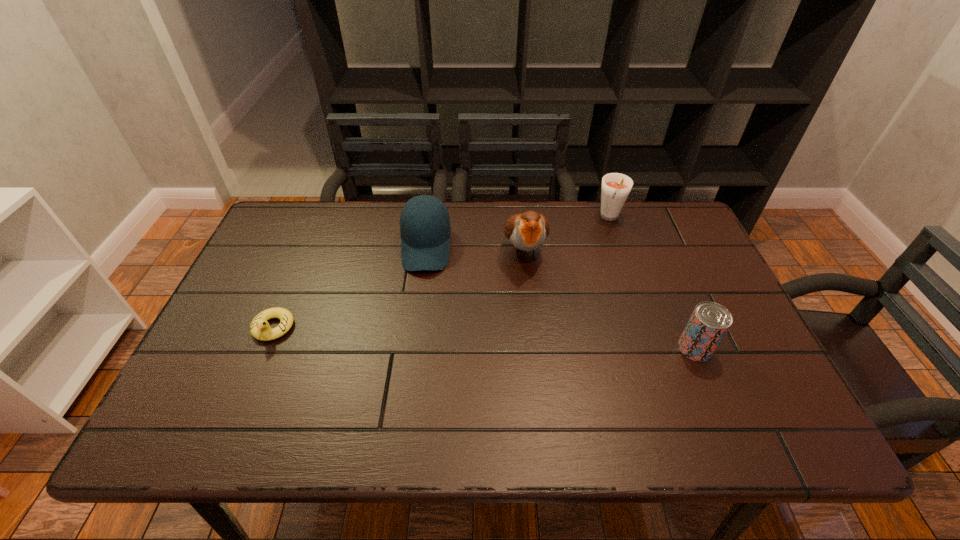
This screenshot has width=960, height=540. I want to click on the leftmost object, so click(260, 329).

You are a GUI agent. You are given a task and a screenshot of the screen. Output one action in this format:
    pyautogui.click(x=<x>, y=<y>)
    Task: Click on the duckling
    
    Given the screenshot: What is the action you would take?
    pyautogui.click(x=260, y=329)

Locate an element on the screen. The width and height of the screenshot is (960, 540). beer can is located at coordinates (709, 322).

This screenshot has height=540, width=960. I want to click on the third object from right to left, so click(x=527, y=231).

Locate an element on the screen. This screenshot has width=960, height=540. root beer is located at coordinates (616, 187).

This screenshot has width=960, height=540. What are the coordinates of `the fourth object from right to left` in the screenshot? It's located at click(x=425, y=229).

Identify the location of free space located on the face of the duckling. (258, 364).

This screenshot has width=960, height=540. In order to click on vacant space situated 0.130m on the left of the beer can in this screenshot , I will do `click(624, 348)`.

Where is `blank space located at the face of the third object from right to left`? The image size is (960, 540). blank space located at the face of the third object from right to left is located at coordinates (531, 298).

You are a GUI agent. You are given a task and a screenshot of the screen. Output one action in this format:
    pyautogui.click(x=<x>, y=<y>)
    Task: Click on the vacant region located 0.060m at the face of the third object from right to left
    
    Given the screenshot: What is the action you would take?
    (531, 295)